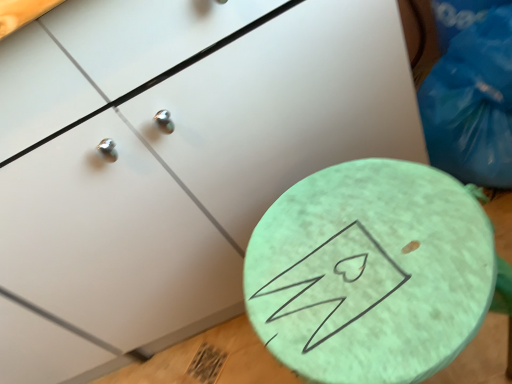
Image resolution: width=512 pixels, height=384 pixels. Describe the element at coordinates (370, 273) in the screenshot. I see `mint green textured table at center` at that location.

I want to click on mint green textured table at center, so click(370, 273).

Where is `blue plastic bag at upper right`? blue plastic bag at upper right is located at coordinates (470, 92).

What do you see at coordinates (470, 92) in the screenshot?
I see `blue plastic bag at upper right` at bounding box center [470, 92].

Identify the location of mint green textured table at center. Image resolution: width=512 pixels, height=384 pixels. (370, 273).

Considering the positions of objects blue plastic bag at upper right and mint green textured table at center in the image provided, who is more to the left, blue plastic bag at upper right or mint green textured table at center?

From the viewer's perspective, mint green textured table at center appears more on the left side.

Which object is further away from the camera, blue plastic bag at upper right or mint green textured table at center?

blue plastic bag at upper right is further from the camera.

Does point (471, 51) come farther from viewer compared to point (339, 359)?

Yes, point (471, 51) is behind point (339, 359).

Looking at this image, from the image's perspective, which is below, blue plastic bag at upper right or mint green textured table at center?

mint green textured table at center appears lower in the image.

From a real-world perspective, which is physically below, blue plastic bag at upper right or mint green textured table at center?

From a 3D spatial view, mint green textured table at center is below.

Can you confirm if blue plastic bag at upper right is thinner than mint green textured table at center?

Yes, blue plastic bag at upper right is thinner than mint green textured table at center.

Considering the sizes of objects blue plastic bag at upper right and mint green textured table at center in the image provided, who is taller, blue plastic bag at upper right or mint green textured table at center?

mint green textured table at center is taller.

Based on their sizes in the image, would you say blue plastic bag at upper right is bigger or smaller than mint green textured table at center?

Clearly, blue plastic bag at upper right is smaller in size than mint green textured table at center.

Is blue plastic bag at upper right not inside mint green textured table at center?

Yes, blue plastic bag at upper right is not within mint green textured table at center.

Are blue plastic bag at upper right and mint green textured table at center far apart?

No, blue plastic bag at upper right is not far away from mint green textured table at center.

Does blue plastic bag at upper right turn towards mint green textured table at center?

No, blue plastic bag at upper right is not aimed at mint green textured table at center.

What's the angular difference between blue plastic bag at upper right and mint green textured table at center's facing directions?

0.00015 degrees.

Locate an element on the screen. The width and height of the screenshot is (512, 384). round table on the left of the blue plastic bag at upper right is located at coordinates (370, 273).

Does mint green textured table at center appear on the left side of blue plastic bag at upper right?

Yes, mint green textured table at center is to the left of blue plastic bag at upper right.

Is mint green textured table at center further to camera compared to blue plastic bag at upper right?

No, it is in front of blue plastic bag at upper right.

Between point (326, 235) and point (441, 49), which one is positioned behind?

The point (441, 49) is more distant.

From the image's perspective, does mint green textured table at center appear lower than blue plastic bag at upper right?

Correct, mint green textured table at center appears lower than blue plastic bag at upper right in the image.

From the picture: From a real-world perspective, which object stands above the other?

In real-world perspective, blue plastic bag at upper right is above.

Considering the sizes of mint green textured table at center and blue plastic bag at upper right in the image, is mint green textured table at center wider or thinner than blue plastic bag at upper right?

Considering their sizes, mint green textured table at center looks broader than blue plastic bag at upper right.

Which of these two, mint green textured table at center or blue plastic bag at upper right, stands shorter?

With less height is blue plastic bag at upper right.

Between mint green textured table at center and blue plastic bag at upper right, which one has smaller size?

Smaller between the two is blue plastic bag at upper right.

Would you say mint green textured table at center is outside blue plastic bag at upper right?

Yes, mint green textured table at center is located beyond the bounds of blue plastic bag at upper right.

Is mint green textured table at center positioned far away from blue plastic bag at upper right?

They are positioned close to each other.

Is mint green textured table at center aimed at blue plastic bag at upper right?

No, mint green textured table at center does not turn towards blue plastic bag at upper right.

What's the angular difference between mint green textured table at center and blue plastic bag at upper right's facing directions?

The facing directions of mint green textured table at center and blue plastic bag at upper right are 0.00015 degrees apart.

Locate an element on the screen. This screenshot has height=384, width=512. round table that is under the blue plastic bag at upper right (from a real-world perspective) is located at coordinates (370, 273).

There is a mint green textured table at center. Where is `garbage above it (from a real-world perspective)`? This screenshot has height=384, width=512. garbage above it (from a real-world perspective) is located at coordinates (470, 92).

Identify the location of garbage above the mint green textured table at center (from the image's perspective). (470, 92).